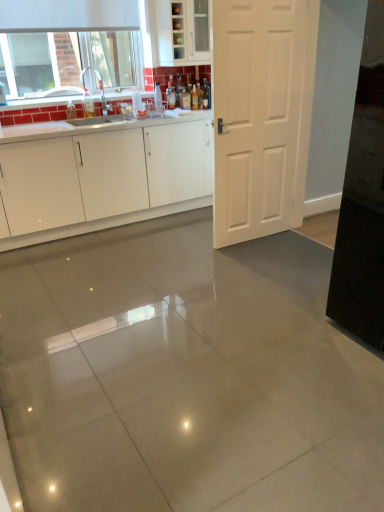
Measure the distance between translucent amber bottle at upper center, positioned as the 2th bottle in right-to-left order, and camera.

A distance of 4.12 meters exists between translucent amber bottle at upper center, positioned as the 2th bottle in right-to-left order, and camera.

What is the approximate height of white glossy cabinet at upper center, the second cabinetry positioned from the bottom?

white glossy cabinet at upper center, the second cabinetry positioned from the bottom, is 58.39 centimeters tall.

What do you see at coordinates (175, 31) in the screenshot? I see `white glossy cabinet at upper center, the second cabinetry positioned from the bottom` at bounding box center [175, 31].

The image size is (384, 512). What do you see at coordinates (261, 114) in the screenshot? I see `white matte door at center` at bounding box center [261, 114].

What is the approximate height of white matte door at center?

It is 5.70 feet.

The width and height of the screenshot is (384, 512). What do you see at coordinates (88, 105) in the screenshot?
I see `translucent plastic bottle at upper left, positioned as the 4th bottle in right-to-left order` at bounding box center [88, 105].

Locate an element on the screen. The width and height of the screenshot is (384, 512). translucent amber bottle at upper center, positioned as the 2th bottle in right-to-left order is located at coordinates tap(194, 98).

Who is smaller, translucent amber bottle at upper center, positioned as the 2th bottle in right-to-left order, or white glossy cabinet at upper center, acting as the 1th cabinetry starting from the top?

Smaller between the two is translucent amber bottle at upper center, positioned as the 2th bottle in right-to-left order.

Could you tell me if translucent amber bottle at upper center, positioned as the 2th bottle in right-to-left order, is turned towards white glossy cabinet at upper center, acting as the 1th cabinetry starting from the top?

No.

Is white glossy cabinet at upper center, acting as the 1th cabinetry starting from the top, surrounded by translucent amber bottle at upper center, which is the 3th bottle from left to right?

No, white glossy cabinet at upper center, acting as the 1th cabinetry starting from the top, is not a part of translucent amber bottle at upper center, which is the 3th bottle from left to right.

Is translucent amber bottle at upper center, which is the 3th bottle from left to right, positioned far away from white glossy cabinet at upper center, the second cabinetry positioned from the bottom?

No, there isn't a large distance between translucent amber bottle at upper center, which is the 3th bottle from left to right, and white glossy cabinet at upper center, the second cabinetry positioned from the bottom.

The width and height of the screenshot is (384, 512). I want to click on door that appears on the right of translucent amber bottle at upper center, which is the 3th bottle from left to right, so click(x=261, y=114).

Does white matte door at center appear on the right side of translucent amber bottle at upper center, positioned as the 2th bottle in right-to-left order?

Correct, you'll find white matte door at center to the right of translucent amber bottle at upper center, positioned as the 2th bottle in right-to-left order.

Considering the sizes of objects white matte door at center and translucent amber bottle at upper center, positioned as the 2th bottle in right-to-left order, in the image provided, who is taller, white matte door at center or translucent amber bottle at upper center, positioned as the 2th bottle in right-to-left order,?

Standing taller between the two is white matte door at center.

What's the angular difference between translucent plastic bottle at upper left, positioned as the 4th bottle in right-to-left order, and translucent amber bottle at upper center, positioned as the 2th bottle in right-to-left order,'s facing directions?

1.72 degrees separate the facing orientations of translucent plastic bottle at upper left, positioned as the 4th bottle in right-to-left order, and translucent amber bottle at upper center, positioned as the 2th bottle in right-to-left order.

Is translucent plastic bottle at upper left, placed as the 1th bottle when sorted from left to right, taller than translucent amber bottle at upper center, positioned as the 2th bottle in right-to-left order?

Indeed, translucent plastic bottle at upper left, placed as the 1th bottle when sorted from left to right, has a greater height compared to translucent amber bottle at upper center, positioned as the 2th bottle in right-to-left order.

From the image's perspective, is translucent plastic bottle at upper left, placed as the 1th bottle when sorted from left to right, on translucent amber bottle at upper center, which is the 3th bottle from left to right?

Actually, translucent plastic bottle at upper left, placed as the 1th bottle when sorted from left to right, appears below translucent amber bottle at upper center, which is the 3th bottle from left to right, in the image.

From a real-world perspective, is translucent glass bottle at center, placed as the fourth bottle when sorted from left to right, positioned over translucent plastic bottle at upper left, positioned as the 4th bottle in right-to-left order, based on gravity?

Yes.

Is translucent glass bottle at center, placed as the fourth bottle when sorted from left to right, facing away from translucent plastic bottle at upper left, positioned as the 4th bottle in right-to-left order?

No, translucent glass bottle at center, placed as the fourth bottle when sorted from left to right,'s orientation is not away from translucent plastic bottle at upper left, positioned as the 4th bottle in right-to-left order.

You are a GUI agent. You are given a task and a screenshot of the screen. Output one action in this format:
    pyautogui.click(x=<x>, y=<y>)
    Task: Click on the bottle that is the 3rd one when counting forward from the translucent glass bottle at center, placed as the fourth bottle when sorted from left to right
    This screenshot has width=384, height=512.
    Given the screenshot: What is the action you would take?
    pyautogui.click(x=88, y=105)

Considering the relative positions of translucent glass bottle at center, placed as the fourth bottle when sorted from left to right, and translucent plastic bottle at upper left, placed as the 1th bottle when sorted from left to right, in the image provided, is translucent glass bottle at center, placed as the fourth bottle when sorted from left to right, to the left or to the right of translucent plastic bottle at upper left, placed as the 1th bottle when sorted from left to right,?

Based on their positions, translucent glass bottle at center, placed as the fourth bottle when sorted from left to right, is located to the right of translucent plastic bottle at upper left, placed as the 1th bottle when sorted from left to right.

From a real-world perspective, relative to translucent glass bottle at center, the second bottle viewed from the left, is white glossy cabinet at upper center, acting as the 1th cabinetry starting from the top, vertically above or below?

In terms of real-world spatial position, white glossy cabinet at upper center, acting as the 1th cabinetry starting from the top, is above translucent glass bottle at center, the second bottle viewed from the left.

Considering the relative sizes of white glossy cabinet at upper center, the second cabinetry positioned from the bottom, and translucent glass bottle at center, the third bottle when ordered from right to left, in the image provided, is white glossy cabinet at upper center, the second cabinetry positioned from the bottom, smaller than translucent glass bottle at center, the third bottle when ordered from right to left,?

No.

Which is in front, point (190, 56) or point (169, 88)?

Positioned in front is point (190, 56).

Considering the relative sizes of white glossy cabinet at upper center, the second cabinetry positioned from the bottom, and translucent glass bottle at center, the third bottle when ordered from right to left, in the image provided, is white glossy cabinet at upper center, the second cabinetry positioned from the bottom, taller than translucent glass bottle at center, the third bottle when ordered from right to left,?

Correct, white glossy cabinet at upper center, the second cabinetry positioned from the bottom, is much taller as translucent glass bottle at center, the third bottle when ordered from right to left.

Who is more distant, white matte door at center or translucent plastic bottle at upper left, placed as the 1th bottle when sorted from left to right?

translucent plastic bottle at upper left, placed as the 1th bottle when sorted from left to right, is further from the camera.

From a real-world perspective, which object stands above the other?

translucent plastic bottle at upper left, positioned as the 4th bottle in right-to-left order, is physically above.

From the image's perspective, is white matte door at center positioned above or below translucent plastic bottle at upper left, placed as the 1th bottle when sorted from left to right?

Clearly, from the image's perspective, white matte door at center is below translucent plastic bottle at upper left, placed as the 1th bottle when sorted from left to right.

Is white matte door at center placed right next to translucent plastic bottle at upper left, positioned as the 4th bottle in right-to-left order?

white matte door at center and translucent plastic bottle at upper left, positioned as the 4th bottle in right-to-left order, are not in contact.

Considering the positions of objects white matte window at upper left and white glossy cabinetry at center, marked as the 2th cabinetry in a top-to-bottom arrangement, in the image provided, who is more to the left, white matte window at upper left or white glossy cabinetry at center, marked as the 2th cabinetry in a top-to-bottom arrangement,?

white matte window at upper left.

From a real-world perspective, is white matte window at upper left physically below white glossy cabinetry at center, the first cabinetry positioned from the bottom?

No.

From the image's perspective, relative to white glossy cabinetry at center, marked as the 2th cabinetry in a top-to-bottom arrangement, is white matte window at upper left above or below?

Clearly, from the image's perspective, white matte window at upper left is above white glossy cabinetry at center, marked as the 2th cabinetry in a top-to-bottom arrangement.

From the image's perspective, starting from the white glossy cabinet at upper center, acting as the 1th cabinetry starting from the top, which bottle is the 3rd one below? Please provide its 2D coordinates.

[(194, 98)]

This screenshot has height=512, width=384. What are the coordinates of `door below the translucent amber bottle at upper center, positioned as the 2th bottle in right-to-left order (from a real-world perspective)` in the screenshot? It's located at pyautogui.click(x=261, y=114).

Based on their spatial positions, is white glossy cabinetry at center, marked as the 2th cabinetry in a top-to-bottom arrangement, or translucent glass bottle at center, placed as the 1th bottle when sorted from right to left, further from translucent plastic bottle at upper left, positioned as the 4th bottle in right-to-left order?

The object further to translucent plastic bottle at upper left, positioned as the 4th bottle in right-to-left order, is translucent glass bottle at center, placed as the 1th bottle when sorted from right to left.

Considering their positions, is white matte window at upper left positioned further to translucent amber bottle at upper center, which is the 3th bottle from left to right, than translucent glass bottle at center, the third bottle when ordered from right to left?

white matte window at upper left lies further to translucent amber bottle at upper center, which is the 3th bottle from left to right, than the other object.

Looking at the image, which one is located closer to white glossy cabinetry at center, the first cabinetry positioned from the bottom, white glossy cabinet at upper center, the second cabinetry positioned from the bottom, or white matte door at center?

white matte door at center is positioned closer to the anchor white glossy cabinetry at center, the first cabinetry positioned from the bottom.

When comparing their distances from translucent glass bottle at center, the second bottle viewed from the left, does white glossy cabinet at upper center, the second cabinetry positioned from the bottom, or white matte door at center seem further?

white matte door at center lies further to translucent glass bottle at center, the second bottle viewed from the left, than the other object.

Looking at this image, which object lies nearer to the anchor point white matte window at upper left, translucent glass bottle at center, placed as the fourth bottle when sorted from left to right, or white matte door at center?

translucent glass bottle at center, placed as the fourth bottle when sorted from left to right, lies closer to white matte window at upper left than the other object.

Which object lies further to the anchor point translucent amber bottle at upper center, positioned as the 2th bottle in right-to-left order, translucent plastic bottle at upper left, positioned as the 4th bottle in right-to-left order, or translucent glass bottle at center, placed as the fourth bottle when sorted from left to right?

translucent plastic bottle at upper left, positioned as the 4th bottle in right-to-left order.

Which object lies further to the anchor point translucent plastic bottle at upper left, positioned as the 4th bottle in right-to-left order, white glossy cabinetry at center, marked as the 2th cabinetry in a top-to-bottom arrangement, or translucent glass bottle at center, the second bottle viewed from the left?

white glossy cabinetry at center, marked as the 2th cabinetry in a top-to-bottom arrangement, is positioned further to the anchor translucent plastic bottle at upper left, positioned as the 4th bottle in right-to-left order.

Based on their spatial positions, is white glossy cabinet at upper center, acting as the 1th cabinetry starting from the top, or translucent glass bottle at center, placed as the fourth bottle when sorted from left to right, further from translucent plastic bottle at upper left, positioned as the 4th bottle in right-to-left order?

translucent glass bottle at center, placed as the fourth bottle when sorted from left to right, is positioned further to the anchor translucent plastic bottle at upper left, positioned as the 4th bottle in right-to-left order.

Where is `exhaust hood located between white matte window at upper left and translucent amber bottle at upper center, which is the 3th bottle from left to right, in the left-right direction`? The width and height of the screenshot is (384, 512). exhaust hood located between white matte window at upper left and translucent amber bottle at upper center, which is the 3th bottle from left to right, in the left-right direction is located at coordinates (68, 15).

This screenshot has height=512, width=384. I want to click on bottle between translucent plastic bottle at upper left, positioned as the 4th bottle in right-to-left order, and translucent amber bottle at upper center, positioned as the 2th bottle in right-to-left order, from left to right, so click(x=171, y=96).

Locate an element on the screen. This screenshot has height=512, width=384. exhaust hood situated between white matte window at upper left and white matte door at center from left to right is located at coordinates (68, 15).

The height and width of the screenshot is (512, 384). In order to click on window between white glossy cabinet at upper center, acting as the 1th cabinetry starting from the top, and white glossy cabinetry at center, the first cabinetry positioned from the bottom, from top to bottom in this screenshot , I will do `click(66, 44)`.